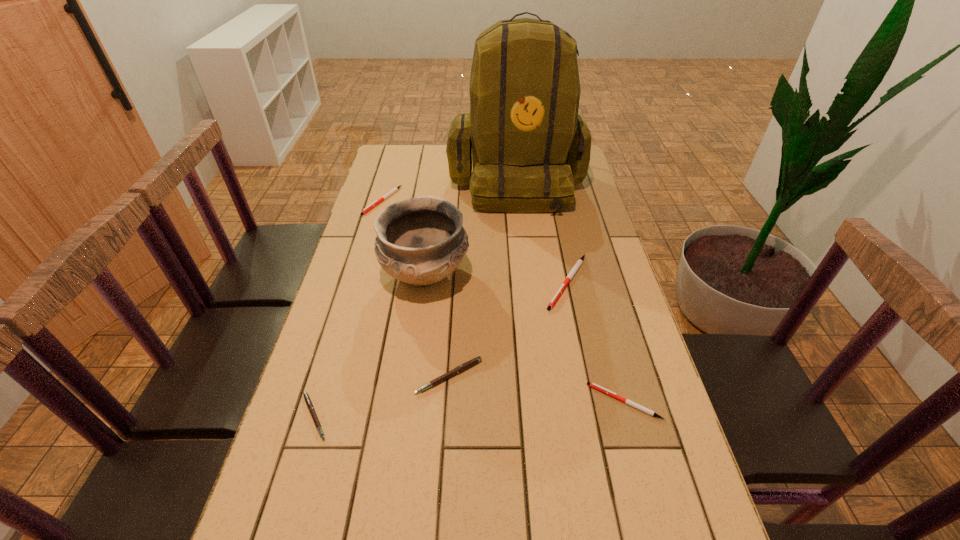
The image size is (960, 540). Identify the location of pottery that is at the left edge. (420, 240).

This screenshot has width=960, height=540. In order to click on backpack situated at the right edge in this screenshot , I will do `click(529, 147)`.

Where is `object that is at the far right corner`? object that is at the far right corner is located at coordinates (529, 147).

At what (x,y) coordinates should I click in order to perform the action: click on vacant position at the far edge of the desktop. Please return your answer as a coordinate pair (x, y). The width and height of the screenshot is (960, 540). Looking at the image, I should click on (425, 167).

Image resolution: width=960 pixels, height=540 pixels. I want to click on vacant position at the left edge of the desktop, so click(362, 242).

This screenshot has height=540, width=960. In order to click on vacant space at the right edge of the desktop in this screenshot , I will do `click(596, 206)`.

Locate an element on the screen. This screenshot has height=540, width=960. free space between the farthest pen and the bigger pink pen is located at coordinates (416, 288).

Identify the location of vacant area between the biggest white pen and the right pink pen. The image size is (960, 540). (508, 329).

Find the location of a particular element. The image size is (960, 540). vacant space that is in between the pottery and the bigger pink pen is located at coordinates (437, 326).

Find the location of a particular element. Image resolution: width=960 pixels, height=540 pixels. vacant space that is in between the second nearest white pen and the bigger pink pen is located at coordinates (x=508, y=329).